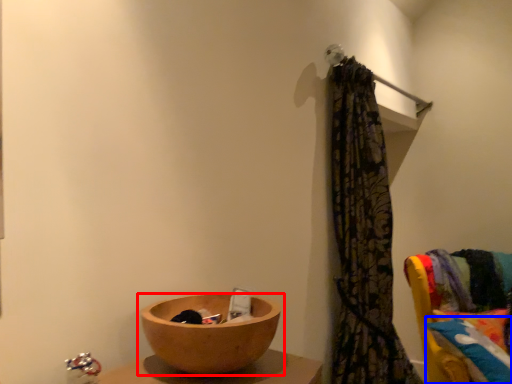
Question: Which of the following is the closest to the observer, tableware (highlighted by a red box) or pillow (highlighted by a blue box)?

Choices:
 (A) tableware
 (B) pillow

Answer: (A)